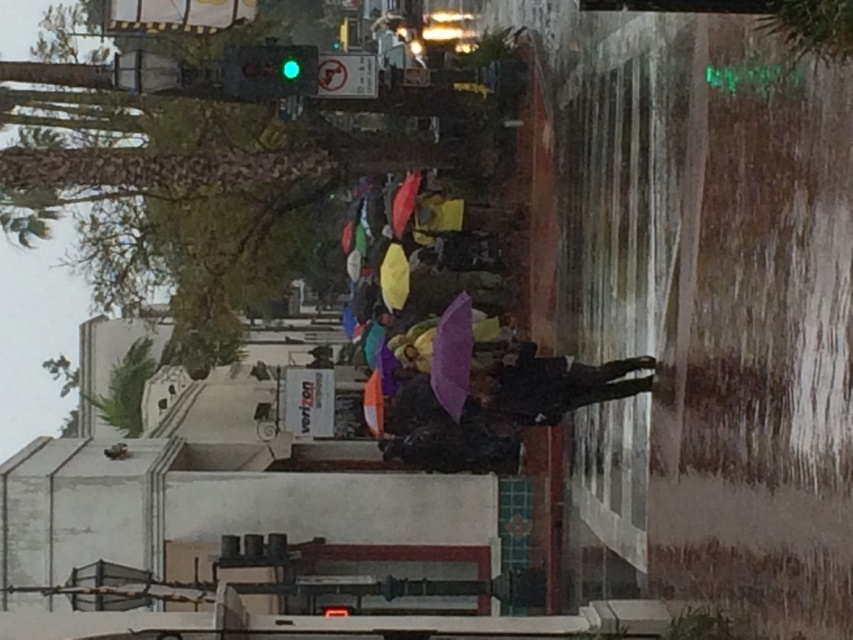
Does dark matte jacket at center have a greater width compared to green glass traffic light at upper center?

Yes, dark matte jacket at center is wider than green glass traffic light at upper center.

What are the coordinates of `dark matte jacket at center` in the screenshot? It's located at (556, 385).

This screenshot has height=640, width=853. What are the coordinates of `dark matte jacket at center` in the screenshot? It's located at (556, 385).

You are a GUI agent. You are given a task and a screenshot of the screen. Output one action in this format:
    pyautogui.click(x=<x>, y=<y>)
    Task: Click on the dark matte jacket at center
    The width and height of the screenshot is (853, 640).
    Given the screenshot: What is the action you would take?
    (x=556, y=385)

Is dark matte jacket at center to the right of purple matte umbrella at center from the viewer's perspective?

Indeed, dark matte jacket at center is positioned on the right side of purple matte umbrella at center.

Does dark matte jacket at center have a lesser width compared to purple matte umbrella at center?

Answer: No.

Measure the distance between dark matte jacket at center and camera.

dark matte jacket at center is 19.42 meters away from camera.

Where is `dark matte jacket at center`? This screenshot has height=640, width=853. dark matte jacket at center is located at coordinates (556, 385).

Can you confirm if green glass traffic light at upper center is positioned to the left of purple matte umbrella at center?

Indeed, green glass traffic light at upper center is positioned on the left side of purple matte umbrella at center.

Identify the location of green glass traffic light at upper center. Image resolution: width=853 pixels, height=640 pixels. (270, 70).